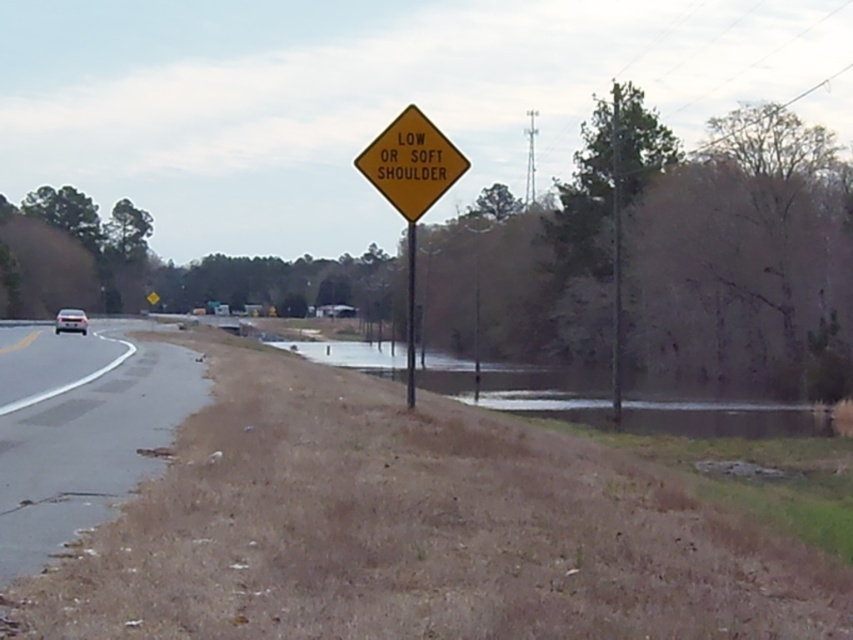
Does brown dirt at lower center lie behind silver metallic car at left?

No, brown dirt at lower center is closer to the viewer.

Is brown dirt at lower center thinner than silver metallic car at left?

In fact, brown dirt at lower center might be wider than silver metallic car at left.

The image size is (853, 640). Identify the location of brown dirt at lower center. (715, 412).

Locate an element on the screen. brown dirt at lower center is located at coordinates (715, 412).

Which is behind, point (38, 330) or point (410, 308)?

Positioned behind is point (38, 330).

Does asphalt road at left appear on the left side of metallic pole at center?

Yes, asphalt road at left is to the left of metallic pole at center.

The image size is (853, 640). I want to click on asphalt road at left, so click(86, 449).

Where is `asphalt road at left`? This screenshot has width=853, height=640. asphalt road at left is located at coordinates (86, 449).

What do you see at coordinates (410, 188) in the screenshot?
I see `yellow diamond-shaped sign at center` at bounding box center [410, 188].

Does yellow diamond-shaped sign at center have a larger size compared to silver metallic car at left?

Incorrect, yellow diamond-shaped sign at center is not larger than silver metallic car at left.

Which is in front, point (438, 138) or point (74, 314)?

Point (438, 138)

In order to click on yellow diamond-shaped sign at center in this screenshot , I will do `click(410, 188)`.